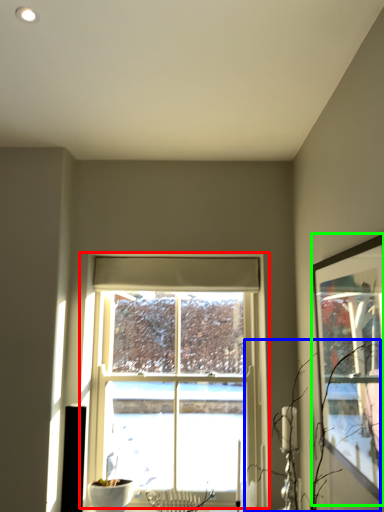
Question: Which object is positioned closest to window (highlighted by a red box)? Select from branch (highlighted by a blue box) and picture frame (highlighted by a green box).

Choices:
 (A) branch
 (B) picture frame

Answer: (A)